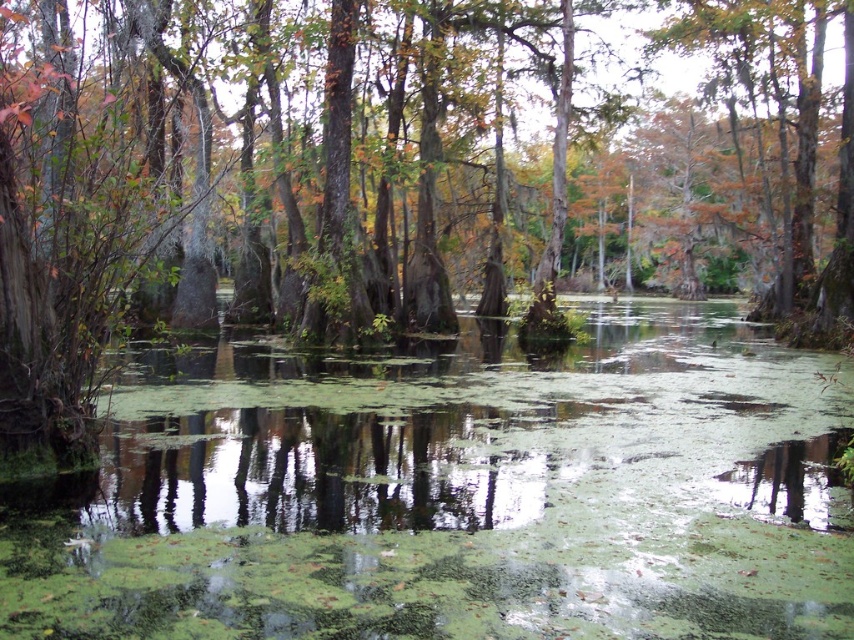
Question: Does green algae water at center appear on the right side of green mossy tree at center?

Choices:
 (A) yes
 (B) no

Answer: (B)

Question: Is green algae water at center to the right of green mossy tree at center from the viewer's perspective?

Choices:
 (A) yes
 (B) no

Answer: (B)

Question: Which point is closer to the camera?

Choices:
 (A) green mossy tree at center
 (B) green algae water at center

Answer: (B)

Question: Is green algae water at center to the left of green mossy tree at center from the viewer's perspective?

Choices:
 (A) yes
 (B) no

Answer: (A)